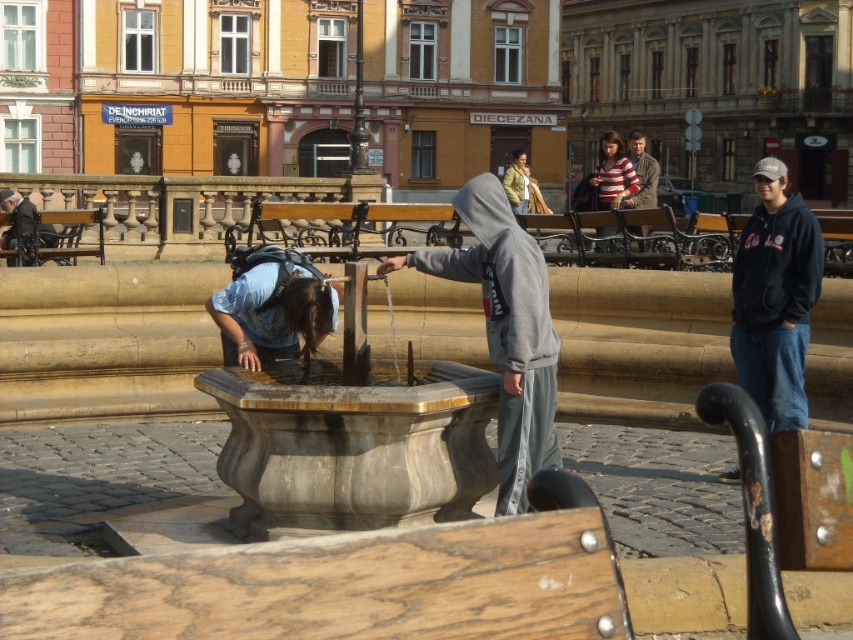
In the urban scene with the fountain, where exactly is the blue denim shirt at lower left located?

The blue denim shirt at lower left is located at point (271,307).

You are a photographer positioned behind the striped cotton shirt at center and the brushed metal water fountain at left. You want to take a photo of the fountain without the person blocking it. Which object should you move to achieve this?

The striped cotton shirt at center is in front of the brushed metal water fountain at left, so you should move the striped cotton shirt at center out of the way to capture the fountain unobstructed.

You are a photographer trying to capture both the striped cotton shirt at center and the brushed metal water fountain at left in the same frame. Based on their heights, which object should you focus on to ensure both are fully visible in your photo?

The striped cotton shirt at center is much taller than the brushed metal water fountain at left, so focusing on the taller striped cotton shirt at center will ensure both are fully visible in the photo.